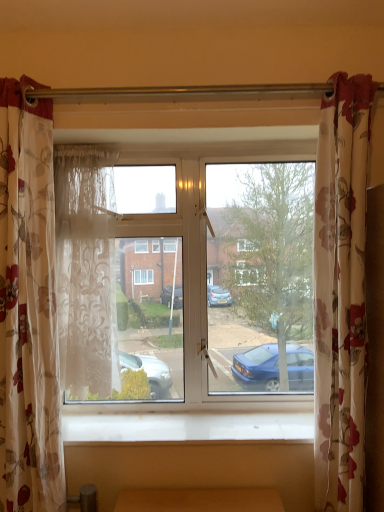
Question: From a real-world perspective, is clear glass window at center physically below white wood at lower center?

Choices:
 (A) yes
 (B) no

Answer: (B)

Question: Is there a large distance between clear glass window at center and white wood at lower center?

Choices:
 (A) no
 (B) yes

Answer: (A)

Question: Is clear glass window at center outside of white wood at lower center?

Choices:
 (A) no
 (B) yes

Answer: (B)

Question: Does clear glass window at center have a smaller size compared to white wood at lower center?

Choices:
 (A) no
 (B) yes

Answer: (A)

Question: From the image's perspective, is clear glass window at center on white wood at lower center?

Choices:
 (A) yes
 (B) no

Answer: (A)

Question: Does clear glass window at center come behind white wood at lower center?

Choices:
 (A) yes
 (B) no

Answer: (A)

Question: Is clear glass window at center positioned with its back to sheer floral fabric curtain at left, which ranks as the 2th curtain in left-to-right order?

Choices:
 (A) no
 (B) yes

Answer: (B)

Question: From a real-world perspective, is clear glass window at center beneath sheer floral fabric curtain at left, which ranks as the 2th curtain in left-to-right order?

Choices:
 (A) no
 (B) yes

Answer: (B)

Question: Considering the relative sizes of clear glass window at center and sheer floral fabric curtain at left, which ranks as the 2th curtain in right-to-left order, in the image provided, is clear glass window at center smaller than sheer floral fabric curtain at left, which ranks as the 2th curtain in right-to-left order,?

Choices:
 (A) no
 (B) yes

Answer: (A)

Question: Are clear glass window at center and sheer floral fabric curtain at left, which ranks as the 2th curtain in right-to-left order, making contact?

Choices:
 (A) yes
 (B) no

Answer: (B)

Question: From a real-world perspective, is clear glass window at center on sheer floral fabric curtain at left, which ranks as the 2th curtain in right-to-left order?

Choices:
 (A) no
 (B) yes

Answer: (A)

Question: Can you confirm if clear glass window at center is thinner than sheer floral fabric curtain at left, which ranks as the 2th curtain in right-to-left order?

Choices:
 (A) no
 (B) yes

Answer: (B)

Question: Is white wood at lower center further to camera compared to sheer floral fabric curtain at left, which ranks as the 2th curtain in right-to-left order?

Choices:
 (A) no
 (B) yes

Answer: (A)